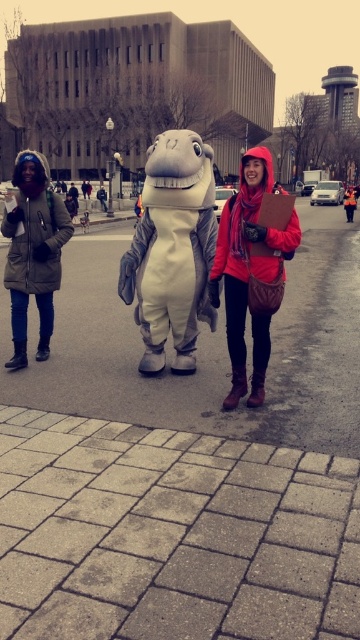
Does matte red scarf at center lie behind matte green coat at left?

No, it is not.

Can you confirm if matte red scarf at center is positioned below matte green coat at left?

No, matte red scarf at center is not below matte green coat at left.

What are the coordinates of `matte red scarf at center` in the screenshot? It's located at (253, 268).

Which is below, brick pavement at center or matte green coat at left?

matte green coat at left is lower down.

Can you confirm if brick pavement at center is wider than matte green coat at left?

Yes.

Between point (27, 396) and point (43, 173), which one is positioned in front?

Point (27, 396) is in front.

Locate an element on the screen. The image size is (360, 640). brick pavement at center is located at coordinates (205, 348).

Can you confirm if white plush dinosaur at center is positioned above matte green coat at left?

Yes.

Where is `white plush dinosaur at center`? This screenshot has height=640, width=360. white plush dinosaur at center is located at coordinates (172, 250).

Identify the location of white plush dinosaur at center. This screenshot has height=640, width=360. pyautogui.click(x=172, y=250).